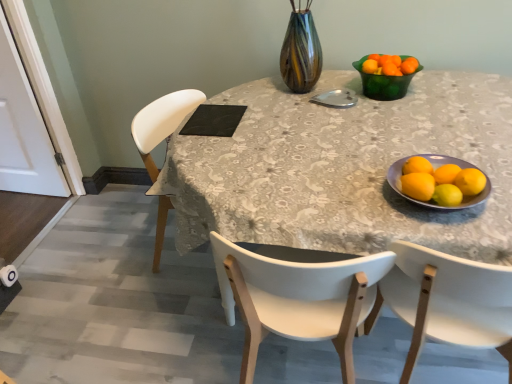
At what (x,y) coordinates should I click in order to perform the action: click on free space to the left of green translucent bowl at upper right. Please return your answer as a coordinate pair (x, y). The width and height of the screenshot is (512, 384). Looking at the image, I should click on coord(330,99).